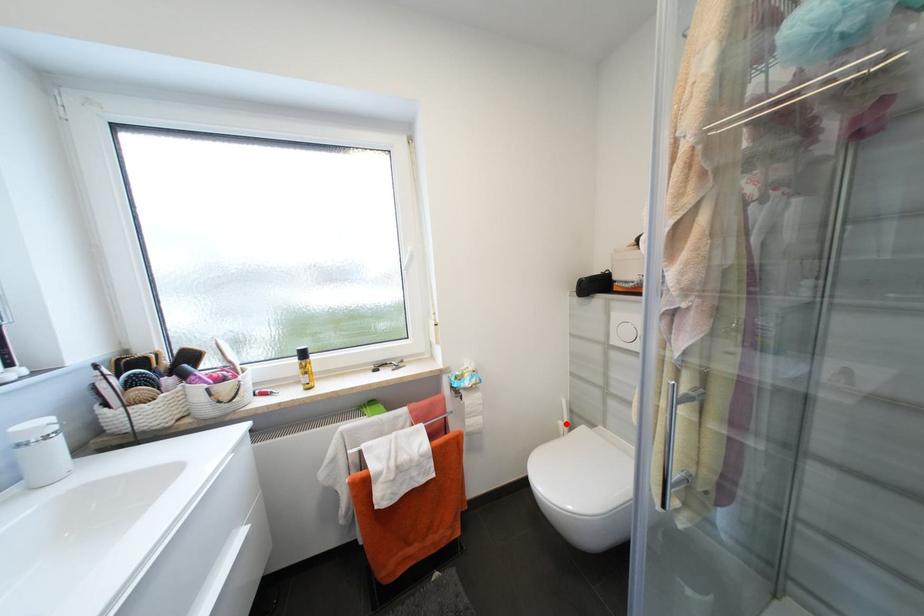
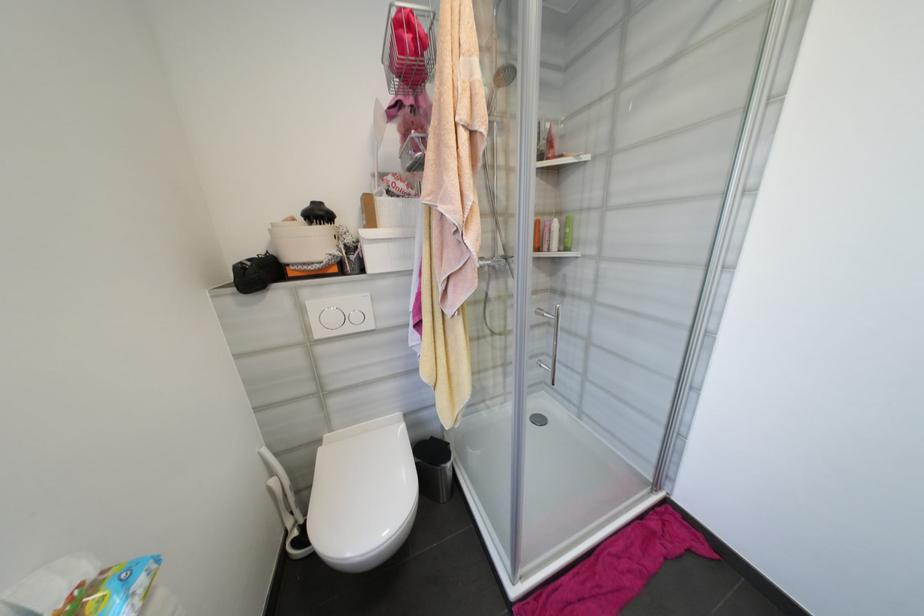
In the second image, find the point that corresponds to the highlighted location in the first image.

(277, 482)